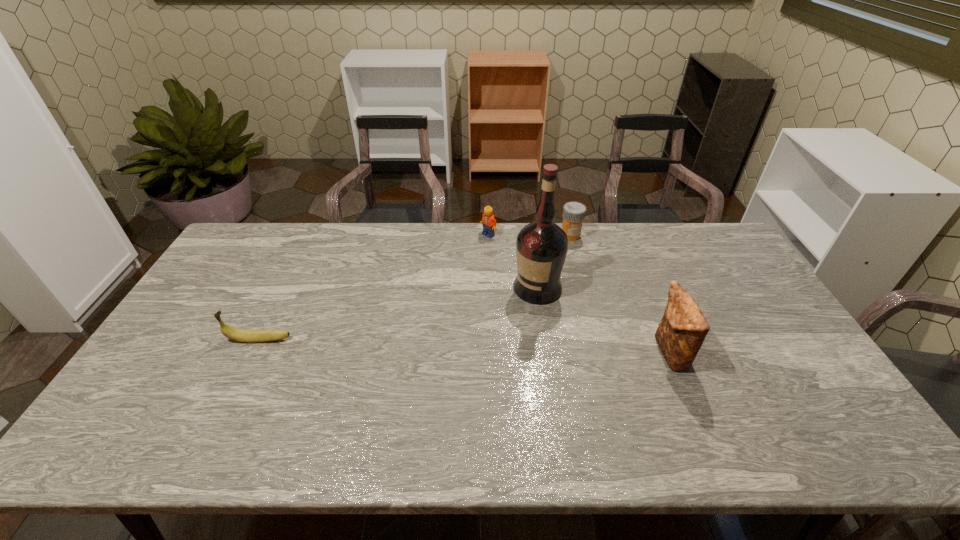
Find the location of `vacant region located on the open side of the second tallest object`. vacant region located on the open side of the second tallest object is located at coordinates (567, 354).

I want to click on free space located on the open side of the second tallest object, so click(608, 354).

Locate an element on the screen. This screenshot has height=540, width=960. free space located on the label side of the medicine is located at coordinates (557, 262).

You are a GUI agent. You are given a task and a screenshot of the screen. Output one action in this format:
    pyautogui.click(x=<x>, y=<y>)
    Task: Click on the vacant space situated 0.170m on the label side of the medicine
    The image size is (960, 540).
    Given the screenshot: What is the action you would take?
    pyautogui.click(x=553, y=269)

Locate an element on the screen. Image resolution: width=960 pixels, height=540 pixels. free spot located on the label side of the medicine is located at coordinates (556, 264).

I want to click on vacant region located 0.090m on the surface of the third nearest object, so click(x=502, y=315).

Locate an element on the screen. This screenshot has width=960, height=540. free space located 0.320m on the surface of the third nearest object is located at coordinates (444, 359).

I want to click on vacant space positioned 0.200m on the surface of the third nearest object, so click(x=475, y=335).

Locate an element on the screen. free space located 0.210m on the front-facing side of the Lego is located at coordinates (461, 274).

Identify the location of vacant point located 0.310m on the front-facing side of the Lego. (447, 293).